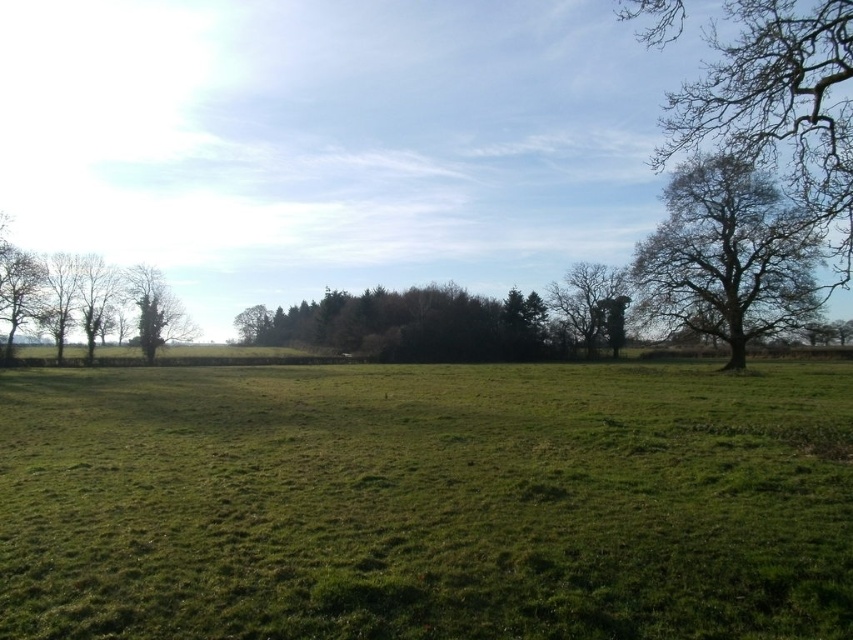
Between bare branches at upper right and green leafy trees at left, which one appears on the left side from the viewer's perspective?

From the viewer's perspective, green leafy trees at left appears more on the left side.

Describe the element at coordinates (779, 104) in the screenshot. This screenshot has width=853, height=640. I see `bare branches at upper right` at that location.

Find the location of a particular element. The width and height of the screenshot is (853, 640). bare branches at upper right is located at coordinates (779, 104).

Which is behind, point (149, 321) or point (141, 305)?

The point (141, 305) is behind.

From the picture: How much distance is there between green leafy trees at left and green leafy tree at left?

A distance of 2.34 meters exists between green leafy trees at left and green leafy tree at left.

Is point (154, 301) behind point (148, 285)?

No, (154, 301) is in front of (148, 285).

You are a GUI agent. You are given a task and a screenshot of the screen. Output one action in this format:
    pyautogui.click(x=<x>, y=<y>)
    Task: Click on the green leafy trees at left
    The image size is (853, 640).
    Given the screenshot: What is the action you would take?
    pyautogui.click(x=103, y=301)

Between green leafy trees at center and green leafy trees at left, which one is positioned lower?

green leafy trees at left is below.

Which of these two, green leafy trees at center or green leafy trees at left, stands shorter?

Standing shorter between the two is green leafy trees at center.

Where is `green leafy trees at center`? The height and width of the screenshot is (640, 853). green leafy trees at center is located at coordinates (408, 324).